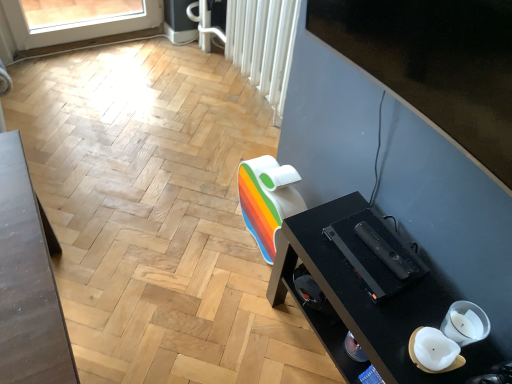
Question: Considering the positions of white textured radiator at upper center and black glossy tv at upper right in the image, is white textured radiator at upper center taller or shorter than black glossy tv at upper right?

Choices:
 (A) tall
 (B) short

Answer: (A)

Question: Is white textured radiator at upper center wider or thinner than black glossy tv at upper right?

Choices:
 (A) wide
 (B) thin

Answer: (B)

Question: Estimate the real-world distances between objects in this image. Which object is closer to the white textured radiator at upper center?

Choices:
 (A) black glossy tv at upper right
 (B) black glossy desk at lower right

Answer: (A)

Question: Which is nearer to the black glossy desk at lower right?

Choices:
 (A) white textured radiator at upper center
 (B) black glossy tv at upper right

Answer: (B)